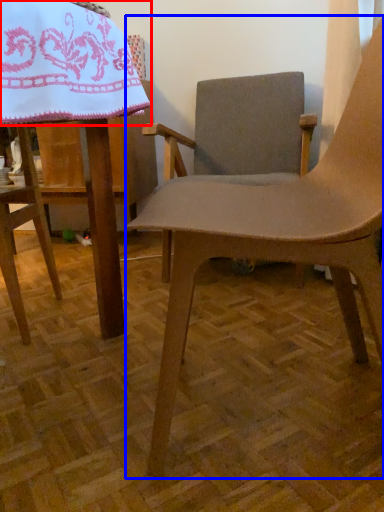
Question: Among these objects, which one is nearest to the camera, blanket (highlighted by a red box) or chair (highlighted by a blue box)?

Choices:
 (A) blanket
 (B) chair

Answer: (A)